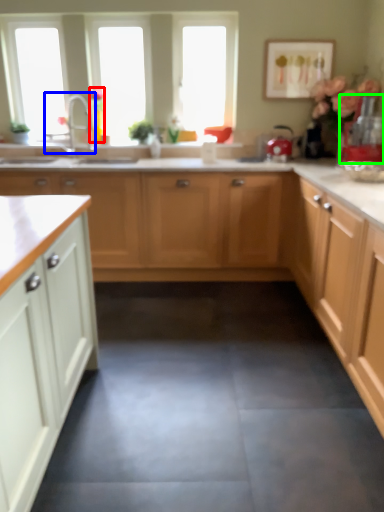
Question: Which object is the closest to the flower (highlighted by a red box)? Choose among these: tap (highlighted by a blue box) or appliance (highlighted by a green box).

Choices:
 (A) tap
 (B) appliance

Answer: (A)